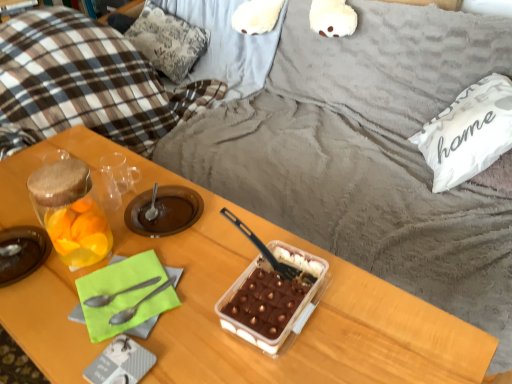
Where is `vacant region in front of metallic silver spoon at lower left, acting as the first spoon starting from the left`? vacant region in front of metallic silver spoon at lower left, acting as the first spoon starting from the left is located at coordinates [113, 341].